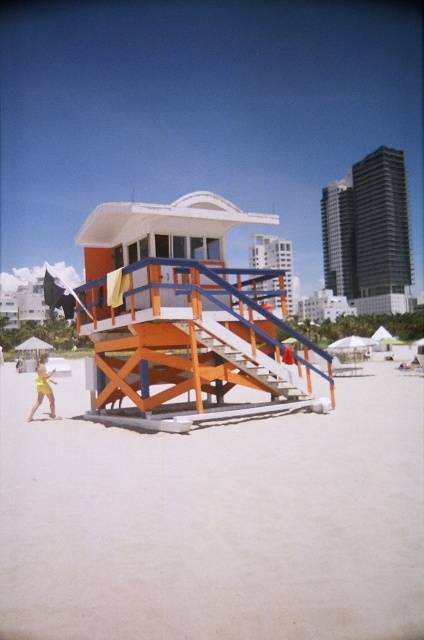
You are standing at the bottom of the orange wooden stairs at center in the beach scene. Which direction should you walk to reach the lifeguard tower?

Since the orange wooden stairs at center are located at point [251,360], you should walk towards the right direction to reach the lifeguard tower.

Based on the photo, you are a photographer trying to capture the orange wood lifeguard tower at center and the beige sandy beach at center in a single shot. Based on their positions, which object should you focus on first to ensure both are in frame?

The beige sandy beach at center is positioned on the left side of the orange wood lifeguard tower at center, so you should focus on the orange wood lifeguard tower at center first to ensure both are in frame.

You are standing at the origin point in the image coordinate system. Where is the beige sandy beach at center located?

The beige sandy beach at center is located at point (214, 522) in the image coordinate system.